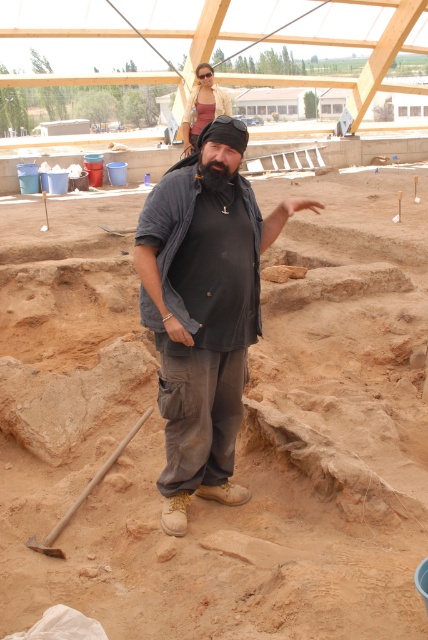
Does gray cotton shirt at center have a greater width compared to bearded man at center?

Correct, the width of gray cotton shirt at center exceeds that of bearded man at center.

Describe the element at coordinates (204, 314) in the screenshot. The height and width of the screenshot is (640, 428). I see `gray cotton shirt at center` at that location.

This screenshot has width=428, height=640. Identify the location of gray cotton shirt at center. (204, 314).

Can you confirm if bearded man at center is thinner than black fuzzy beard at center?

No.

Is point (189, 148) positioned after point (211, 179)?

That is True.

Is point (190, 99) behind point (214, 161)?

Yes, point (190, 99) is farther from viewer.

Locate an element on the screen. The image size is (428, 640). bearded man at center is located at coordinates (202, 106).

Between point (130, 436) and point (204, 164), which one is positioned in front?

Point (204, 164) is more forward.

Is wooden shovel at lower left shorter than black fuzzy beard at center?

Incorrect, wooden shovel at lower left's height does not fall short of black fuzzy beard at center's.

Which is behind, point (125, 440) or point (204, 180)?

Positioned behind is point (125, 440).

Where is `wooden shovel at lower left`? This screenshot has width=428, height=640. wooden shovel at lower left is located at coordinates (83, 497).